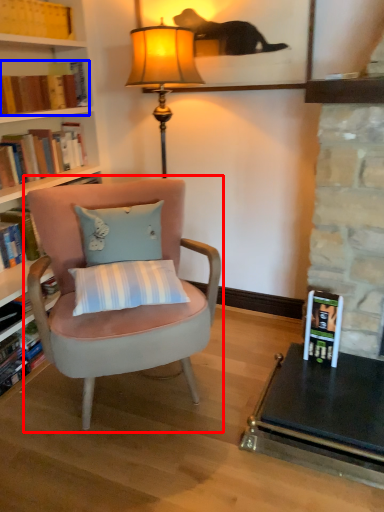
Question: Among these objects, which one is nearest to the camera, chair (highlighted by a red box) or book (highlighted by a blue box)?

Choices:
 (A) chair
 (B) book

Answer: (A)